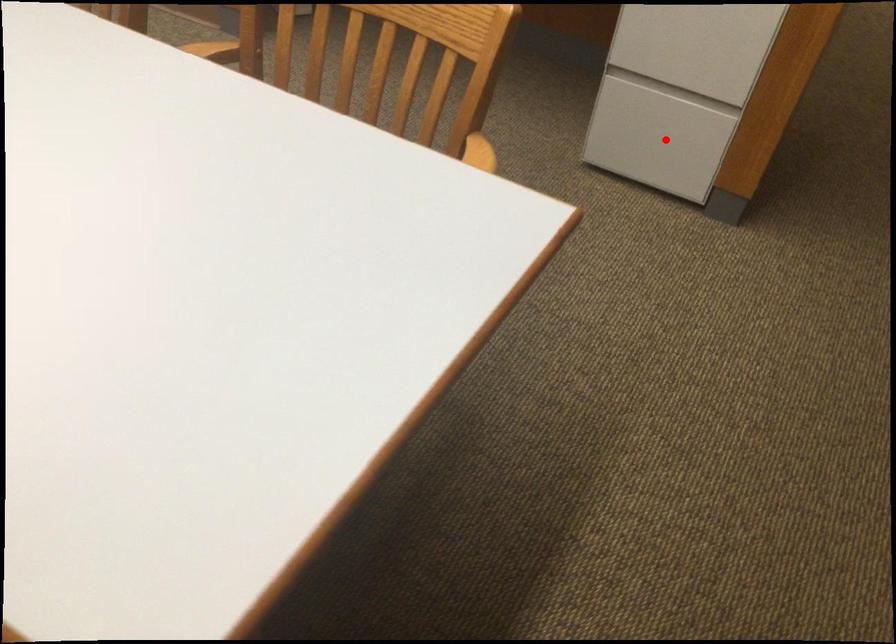
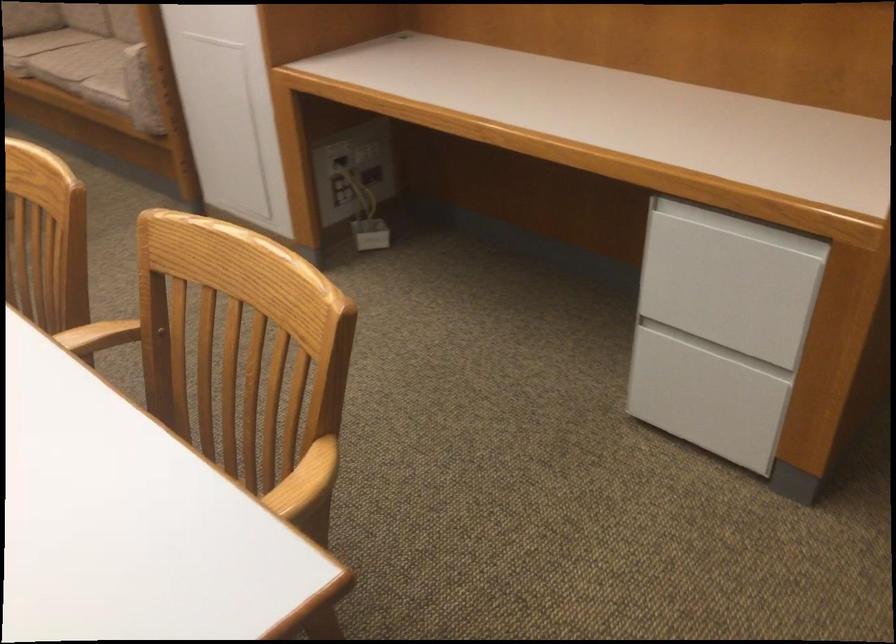
Locate, in the second image, the point that corresponds to the highlighted location in the first image.

(705, 399)